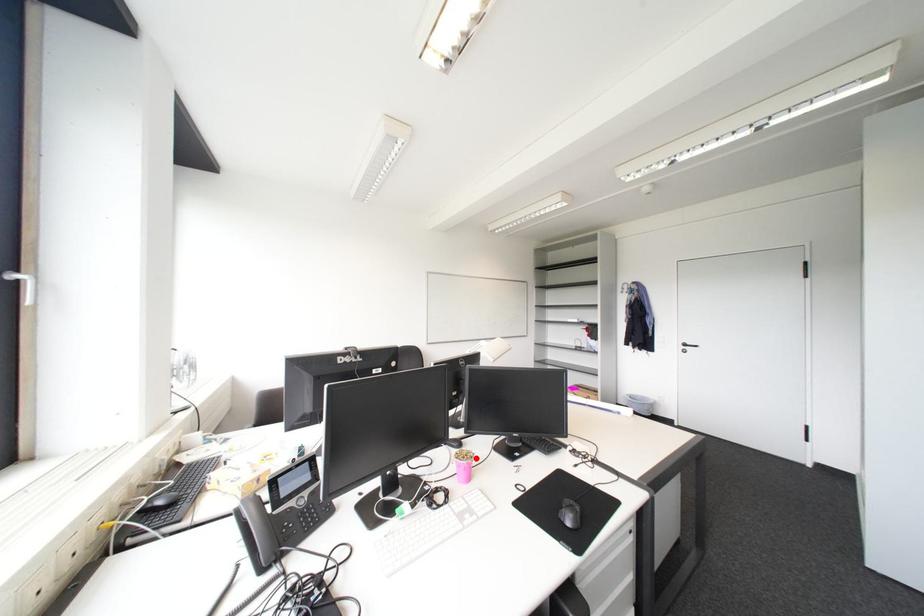
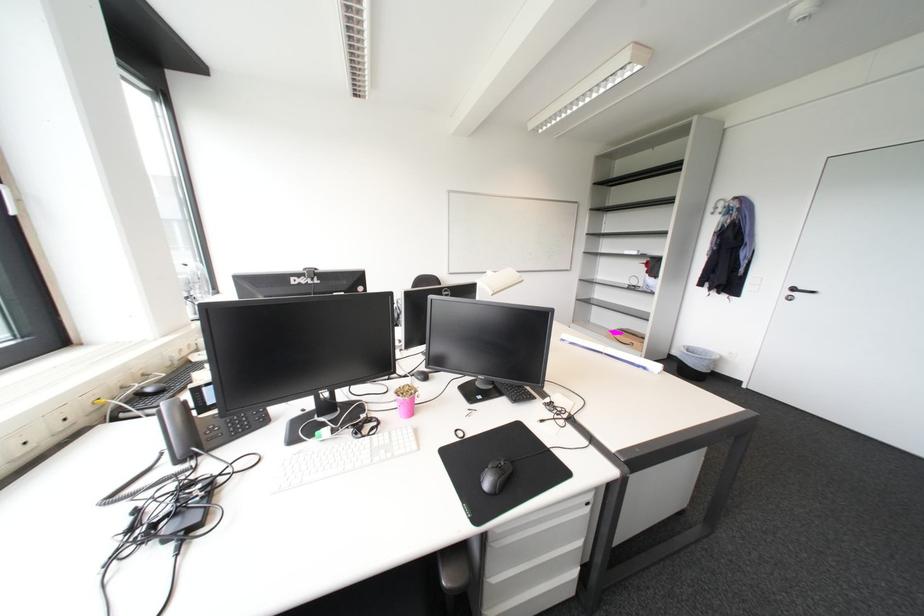
Question: I am providing you with two images of the same scene from different viewpoints. Image1 has a red point marked. In image2, the corresponding 3D location appears at what relative position? Reply with the corresponding letter.

Choices:
 (A) Closer
 (B) Farther

Answer: (A)